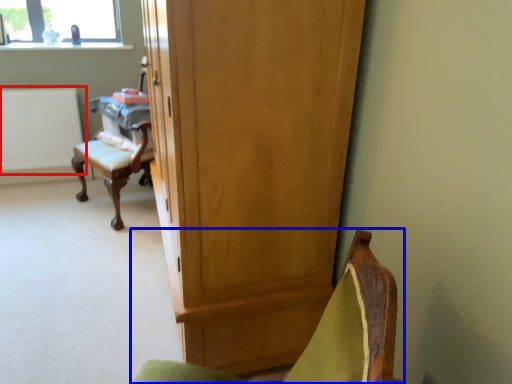
Question: Which point is further to the camera, radiator (highlighted by a red box) or chair (highlighted by a blue box)?

Choices:
 (A) radiator
 (B) chair

Answer: (A)